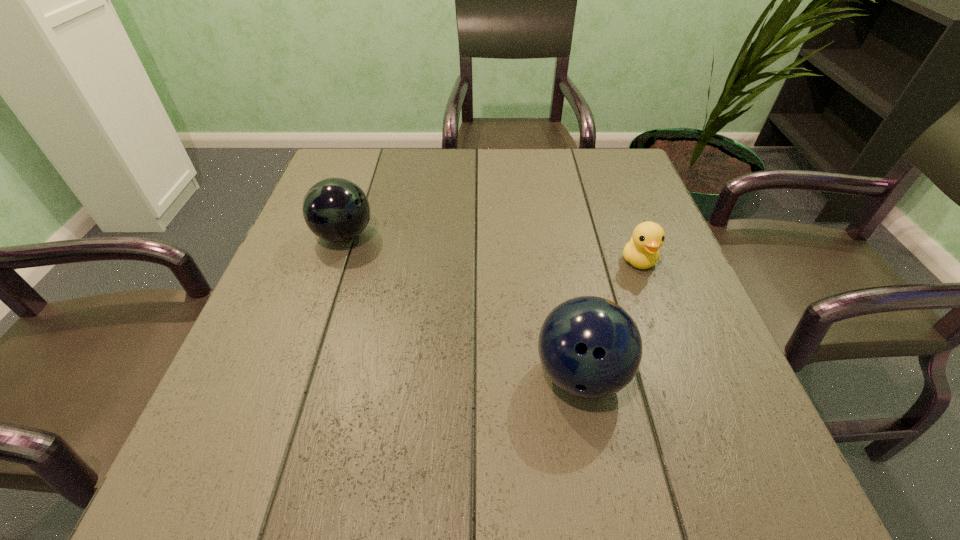
Find the location of `the nearest object`. the nearest object is located at coordinates (590, 347).

The image size is (960, 540). Identify the location of the second object from left to right. (590, 347).

The image size is (960, 540). Find the location of `the leftmost object`. the leftmost object is located at coordinates (337, 210).

You are a GUI agent. You are given a task and a screenshot of the screen. Output one action in this format:
    pyautogui.click(x=<x>, y=<y>)
    Task: Click on the left bowling ball
    The image size is (960, 540).
    Given the screenshot: What is the action you would take?
    pyautogui.click(x=337, y=210)

The height and width of the screenshot is (540, 960). I want to click on the rightmost object, so tap(641, 251).

Where is `the shortest object`? the shortest object is located at coordinates (641, 251).

Locate an element on the screen. free location located on the side of the farther bowling ball with the finger holes is located at coordinates (554, 235).

Where is `free point located 0.340m on the face of the duck`? The width and height of the screenshot is (960, 540). free point located 0.340m on the face of the duck is located at coordinates (706, 440).

Where is `object present at the left edge`? The image size is (960, 540). object present at the left edge is located at coordinates (337, 210).

Find the location of a particular element. The image size is (960, 540). object that is at the right edge is located at coordinates (641, 251).